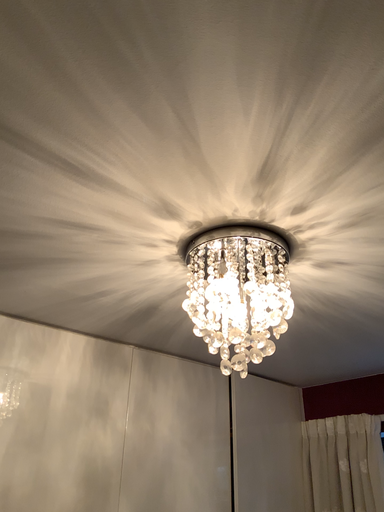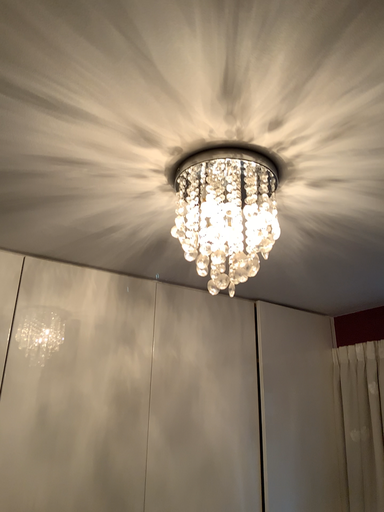
Question: Which way did the camera rotate in the video?

Choices:
 (A) rotated right
 (B) rotated left

Answer: (B)